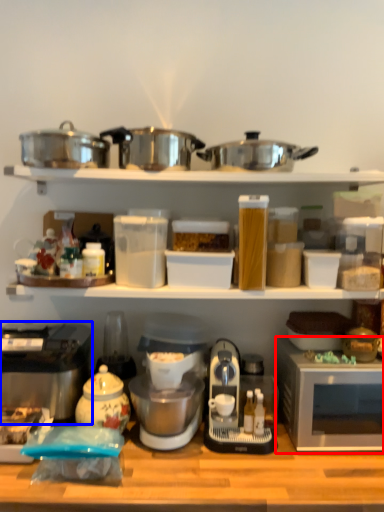
Question: Which of the following is the closest to the observer, microwave oven (highlighted by a red box) or home appliance (highlighted by a blue box)?

Choices:
 (A) microwave oven
 (B) home appliance

Answer: (A)